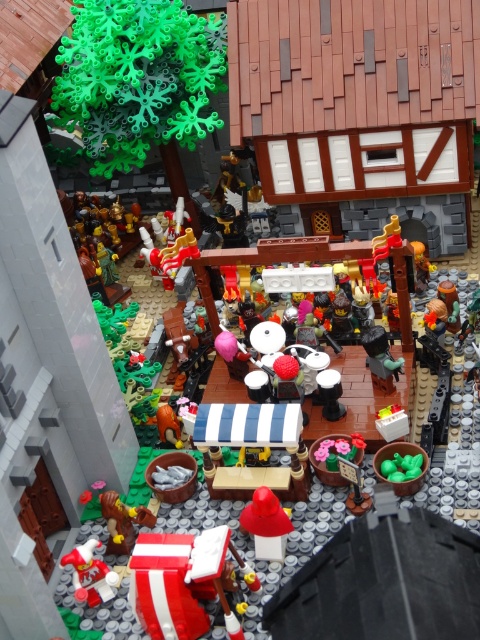
Question: Does smooth red hat at center appear on the left side of smooth brown wooden axe at lower left?

Choices:
 (A) yes
 (B) no

Answer: (B)

Question: Does smooth red hat at center have a greater width compared to matte red santa hat at lower left?

Choices:
 (A) no
 (B) yes

Answer: (A)

Question: Can you confirm if smooth red hat at center is positioned above smooth brown wooden axe at lower left?

Choices:
 (A) yes
 (B) no

Answer: (A)

Question: Estimate the real-world distances between objects in this image. Which object is closer to the matte red santa hat at lower left?

Choices:
 (A) smooth red hat at center
 (B) smooth brown wooden axe at lower left

Answer: (B)

Question: Which point is closer to the camera taking this photo?

Choices:
 (A) (271, 534)
 (B) (82, 582)

Answer: (A)

Question: Which is farther from the smooth red hat at center?

Choices:
 (A) smooth brown wooden axe at lower left
 (B) matte red santa hat at lower left

Answer: (B)